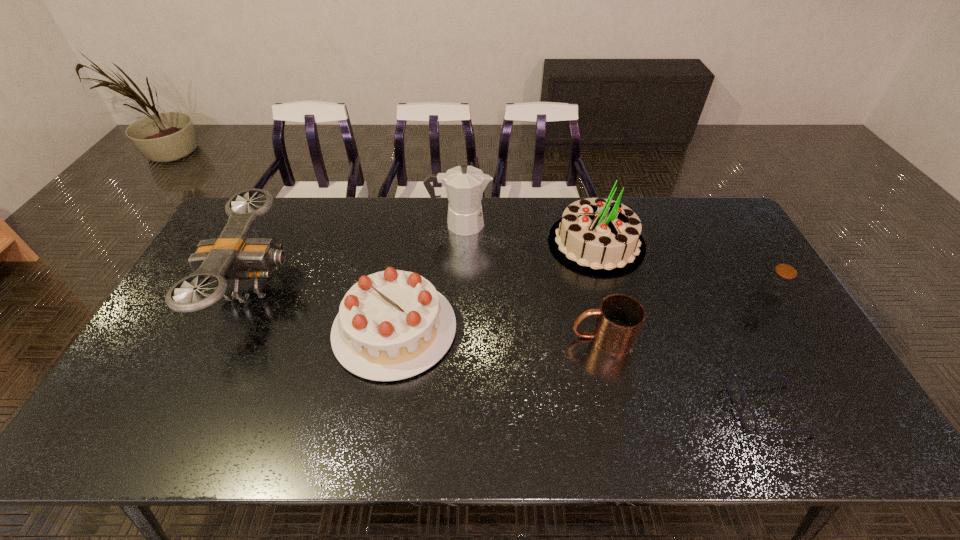
Identify the location of vacant space located at the spout of the coffeepot. The height and width of the screenshot is (540, 960). 529,224.

This screenshot has width=960, height=540. I want to click on vacant space located 0.310m on the right of the farther birthday cake, so click(736, 243).

Where is `free space located on the front-facing side of the drone`? free space located on the front-facing side of the drone is located at coordinates (328, 285).

In order to click on free spot located on the back of the nearer birthday cake in this screenshot , I will do `click(415, 212)`.

The image size is (960, 540). Find the location of `vacant space located 0.100m on the back of the jar`. vacant space located 0.100m on the back of the jar is located at coordinates (747, 267).

Find the location of a particular element. The height and width of the screenshot is (540, 960). free point located 0.340m on the side of the mug with the handle is located at coordinates (446, 338).

Locate an element on the screen. The height and width of the screenshot is (540, 960). free spot located 0.310m on the side of the mug with the handle is located at coordinates (457, 338).

Locate an element on the screen. vacant space situated on the side of the mug with the handle is located at coordinates (548, 338).

Image resolution: width=960 pixels, height=540 pixels. In order to click on vacant space situated on the front-facing side of the spectacles in this screenshot , I will do `click(677, 410)`.

Image resolution: width=960 pixels, height=540 pixels. What are the coordinates of `free spot located on the front-facing side of the spectacles` in the screenshot? It's located at (673, 410).